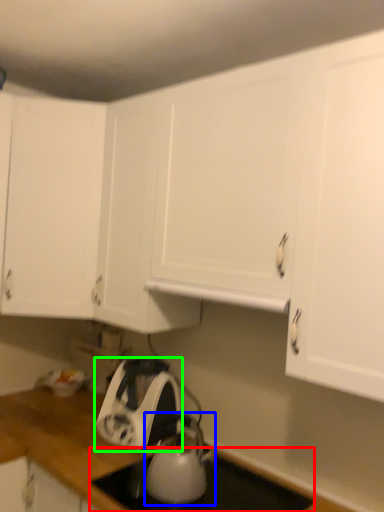
Question: Estimate the real-world distances between objects in this image. Which object is farther from gas stove (highlighted by a red box), kitchen appliance (highlighted by a blue box) or home appliance (highlighted by a green box)?

Choices:
 (A) kitchen appliance
 (B) home appliance

Answer: (B)